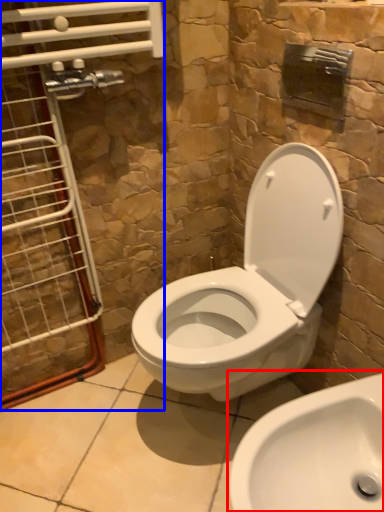
Question: Which of the following is the farthest to the observer, sink (highlighted by a red box) or glass door (highlighted by a blue box)?

Choices:
 (A) sink
 (B) glass door

Answer: (B)